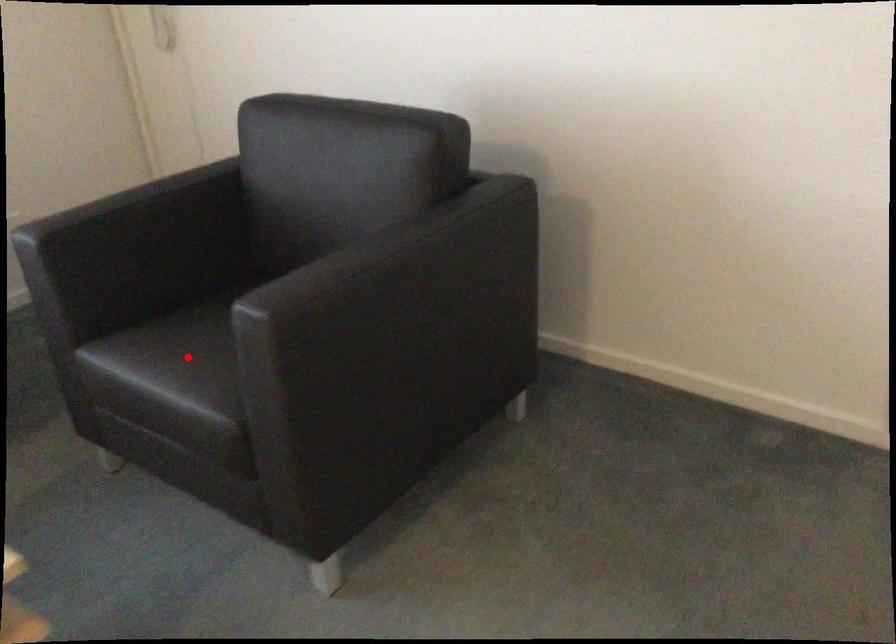
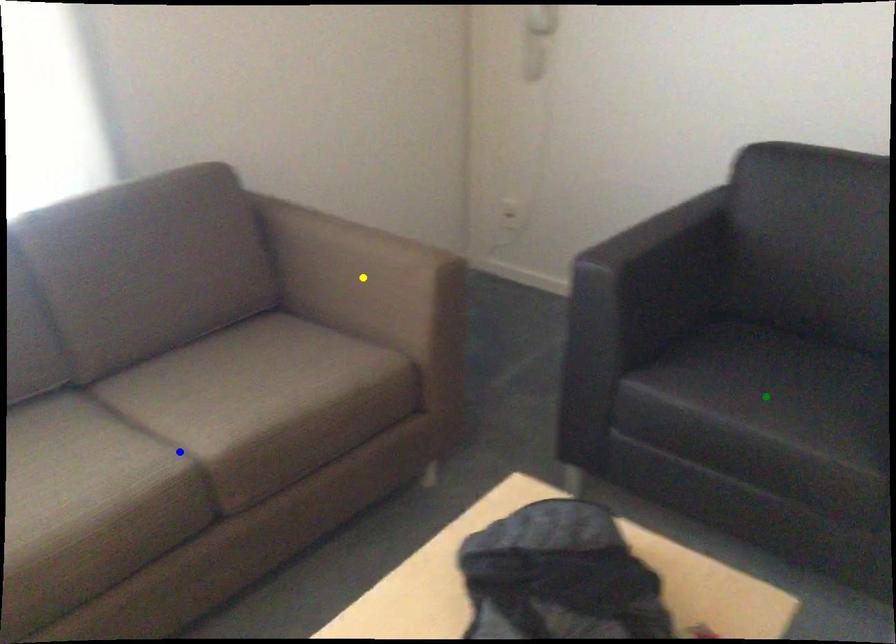
Question: I am providing you with two images of the same scene from different viewpoints. A red point is marked on the first image. You are given multiple points on the second image. Can you choose the point in image 2 that corresponds to the point in image 1?

Choices:
 (A) green point
 (B) yellow point
 (C) blue point

Answer: (A)